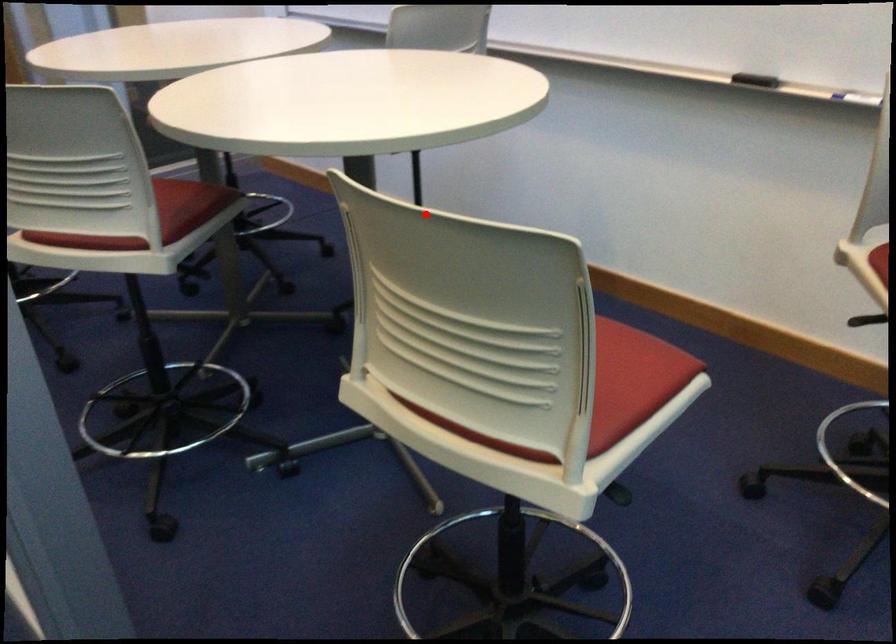
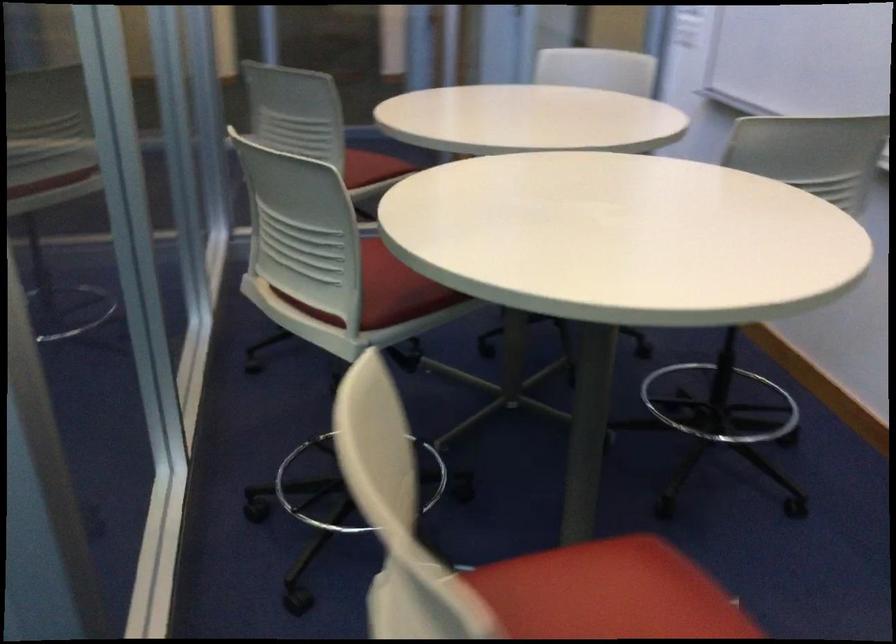
Question: I am providing you with two images of the same scene from different viewpoints. In image1, a red point is highlighted. Considering the same 3D point in image2, which of the following is correct?

Choices:
 (A) It is closer
 (B) It is farther

Answer: (A)